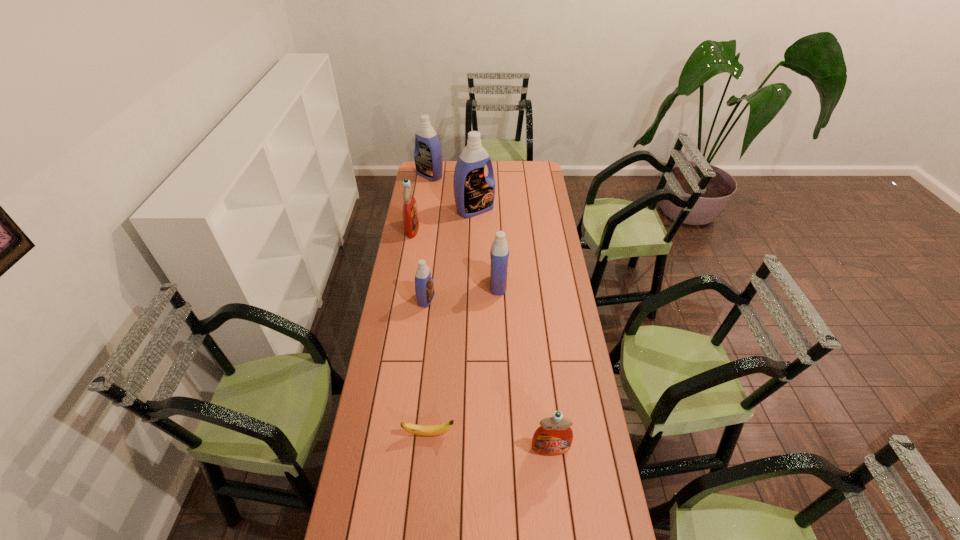
Locate which object ranks second in proximity to the fifth shortest detergent. Please provide its 2D coordinates. Your answer should be formatted as a tuple, i.e. [(x, y)], where the tuple contains the x and y coordinates of a point satisfying the conditions above.

[(410, 211)]

Identify which object is located as the fifth nearest to the bigger red detergent. Please provide its 2D coordinates. Your answer should be formatted as a tuple, i.e. [(x, y)], where the tuple contains the x and y coordinates of a point satisfying the conditions above.

[(425, 430)]

Locate which detergent is the fourth closest to the third biggest blue detergent. Please provide its 2D coordinates. Your answer should be formatted as a tuple, i.e. [(x, y)], where the tuple contains the x and y coordinates of a point satisfying the conditions above.

[(554, 437)]

The width and height of the screenshot is (960, 540). In order to click on the sixth closest detergent relative to the shortest object in this screenshot , I will do `click(428, 158)`.

Locate an element on the screen. blue detergent that can be found as the third closest to the tallest detergent is located at coordinates (424, 287).

I want to click on blue detergent that stands as the closest to the fifth shortest detergent, so click(474, 193).